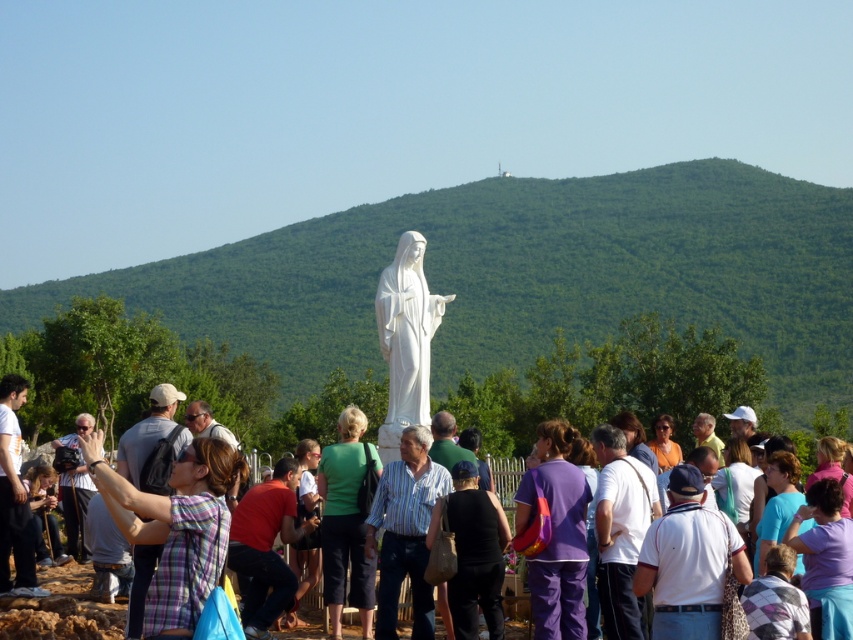
Question: Which is farther from the purple fabric at center?

Choices:
 (A) plaid shirt at lower left
 (B) blue fabric at center

Answer: (A)

Question: Considering the real-world distances, which object is farthest from the purple fabric pants at center?

Choices:
 (A) plaid fabric shirt at center
 (B) green leafy hillside at center
 (C) green fabric shirt at center
 (D) orange fabric at center

Answer: (B)

Question: Can you confirm if plaid fabric shirt at center is positioned to the right of green fabric shirt at center?

Choices:
 (A) yes
 (B) no

Answer: (B)

Question: Where is purple fabric bag at center located in relation to black fabric bag at center in the image?

Choices:
 (A) left
 (B) right

Answer: (A)

Question: Which object is positioned closest to the orange fabric at center?

Choices:
 (A) white marble statue at center
 (B) green leafy hillside at center

Answer: (A)

Question: Is purple fabric bag at center positioned behind black fabric bag at center?

Choices:
 (A) no
 (B) yes

Answer: (A)